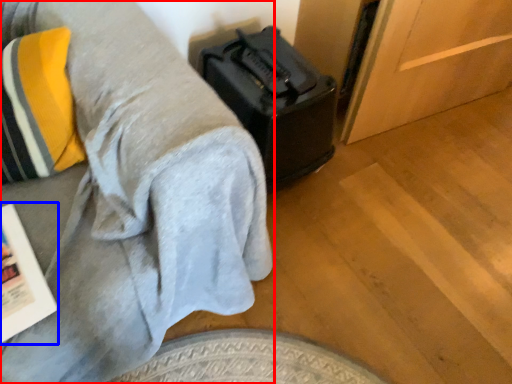
Question: Which object is closer to the camera taking this photo, furniture (highlighted by a red box) or magazine (highlighted by a blue box)?

Choices:
 (A) furniture
 (B) magazine

Answer: (A)